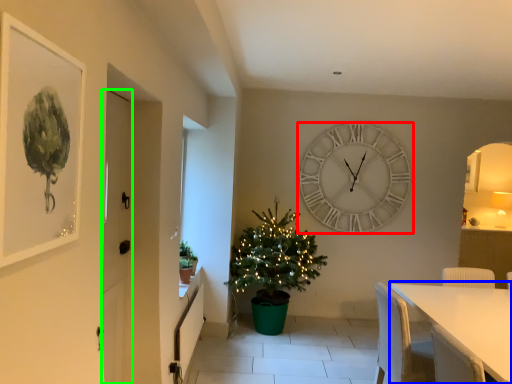
Question: Which object is positioned closest to wall clock (highlighted by a red box)? Select from table (highlighted by a blue box) and door (highlighted by a green box).

Choices:
 (A) table
 (B) door

Answer: (A)